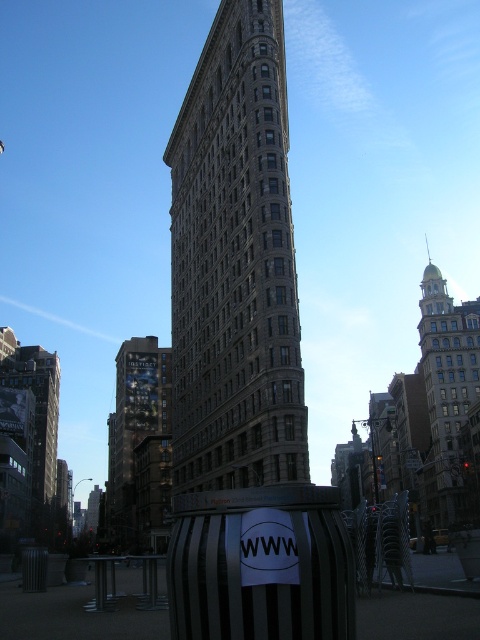
Can you confirm if reflective glass building at center is positioned above dark gray stone building at left?

Incorrect, reflective glass building at center is not positioned above dark gray stone building at left.

Based on the photo, who is more forward, (162, 413) or (41, 378)?

Point (162, 413) is more forward.

Locate an element on the screen. This screenshot has width=480, height=640. reflective glass building at center is located at coordinates (140, 449).

Image resolution: width=480 pixels, height=640 pixels. In order to click on reflective glass building at center in this screenshot , I will do `click(140, 449)`.

Is point (140, 536) positioned after point (448, 458)?

No, it is in front of (448, 458).

Between reflective glass building at center and gold/golden stone tower at right, which one is positioned higher?

gold/golden stone tower at right

At what (x,y) coordinates should I click in order to perform the action: click on reflective glass building at center. Please return your answer as a coordinate pair (x, y). This screenshot has height=640, width=480. Looking at the image, I should click on (140, 449).

Looking at this image, does gold/golden stone tower at right come behind dark gray stone building at left?

Yes.

You are a GUI agent. You are given a task and a screenshot of the screen. Output one action in this format:
    pyautogui.click(x=<x>, y=<y>)
    Task: Click on the gold/golden stone tower at right
    
    Given the screenshot: What is the action you would take?
    pyautogui.click(x=445, y=394)

I want to click on gold/golden stone tower at right, so pos(445,394).